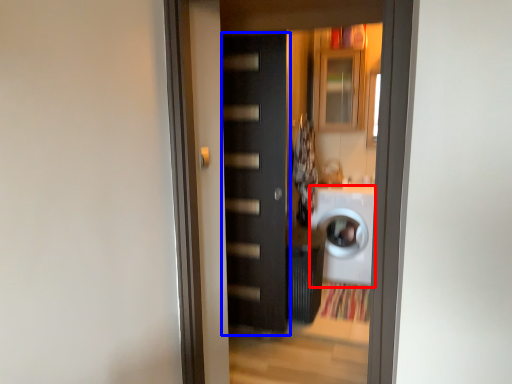
Question: Which object is closer to the camera taking this photo, washing machine (highlighted by a red box) or door (highlighted by a blue box)?

Choices:
 (A) washing machine
 (B) door

Answer: (B)